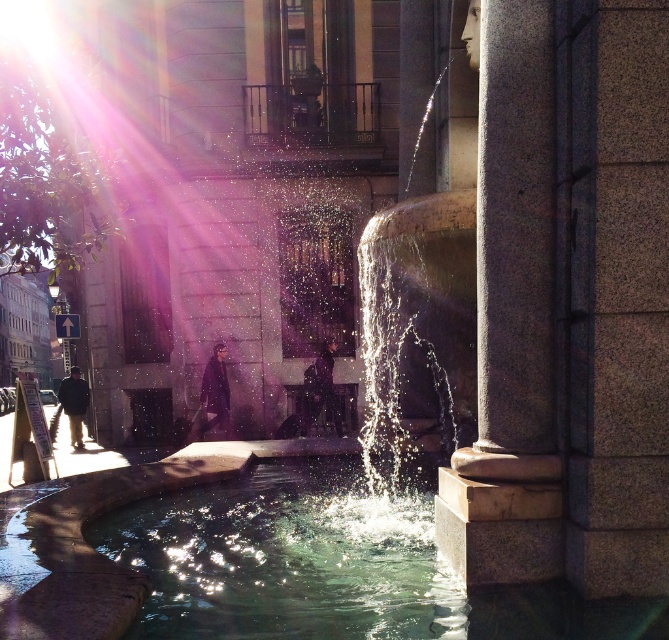
The height and width of the screenshot is (640, 669). What are the coordinates of `granite column at center` in the screenshot? It's located at (510, 317).

Is granite column at center thinner than clear glass water at center?

Yes.

Image resolution: width=669 pixels, height=640 pixels. Identify the location of granite column at center. (510, 317).

I want to click on granite column at center, so click(x=510, y=317).